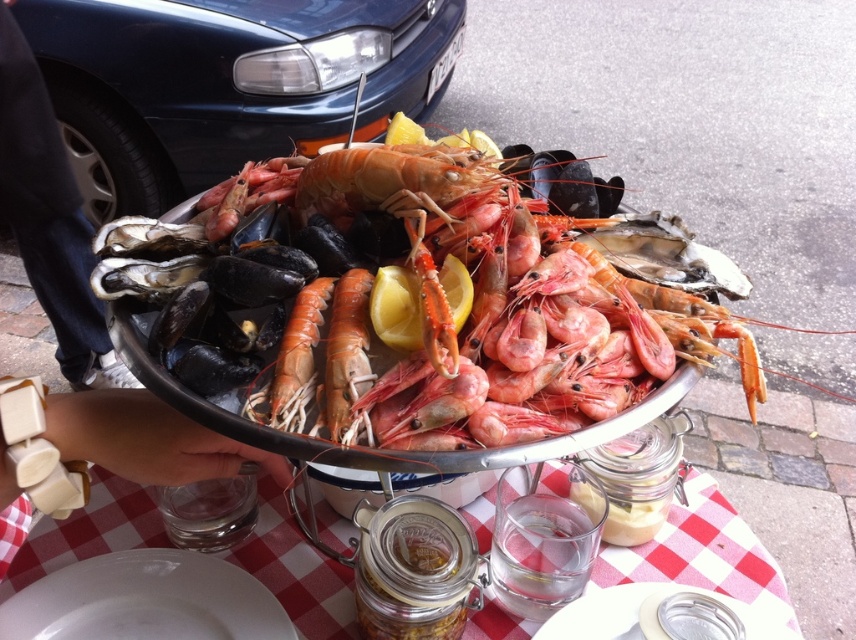
Question: Is blue metallic car at upper left above pink matte shrimp at center?

Choices:
 (A) no
 (B) yes

Answer: (B)

Question: Which of the following is the farthest from the observer?

Choices:
 (A) (355, 38)
 (B) (183, 444)

Answer: (A)

Question: Can you confirm if blue metallic car at upper left is positioned below clear glass jar at center?

Choices:
 (A) no
 (B) yes

Answer: (A)

Question: Does clear glass jar at center have a greater width compared to pink matte shrimp at center?

Choices:
 (A) no
 (B) yes

Answer: (B)

Question: Which is nearer to the blue metallic car at upper left?

Choices:
 (A) clear glass jar at center
 (B) pink glossy shrimp at center

Answer: (B)

Question: Which object is the closest to the blue metallic car at upper left?

Choices:
 (A) clear glass jar at center
 (B) white ceramic table at center
 (C) pink glossy shrimp at center

Answer: (C)